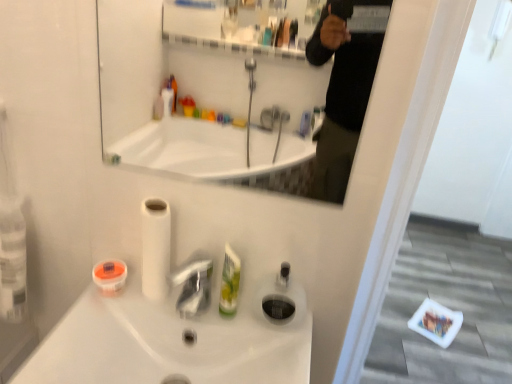
Identify the location of free point above white glossy sink at center (from a real-world perspective). (196, 319).